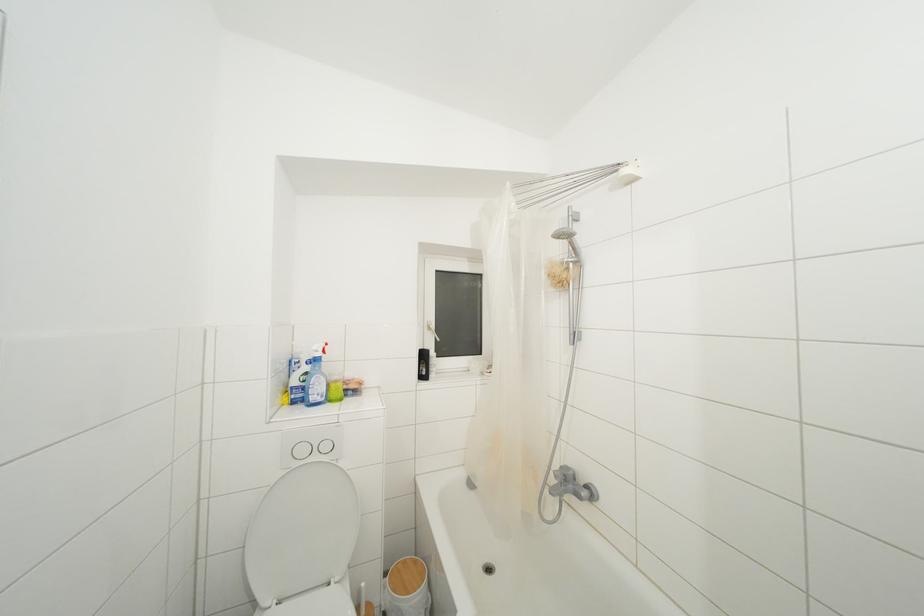
Locate an element on the screen. This screenshot has height=616, width=924. silver shower head is located at coordinates (565, 244).